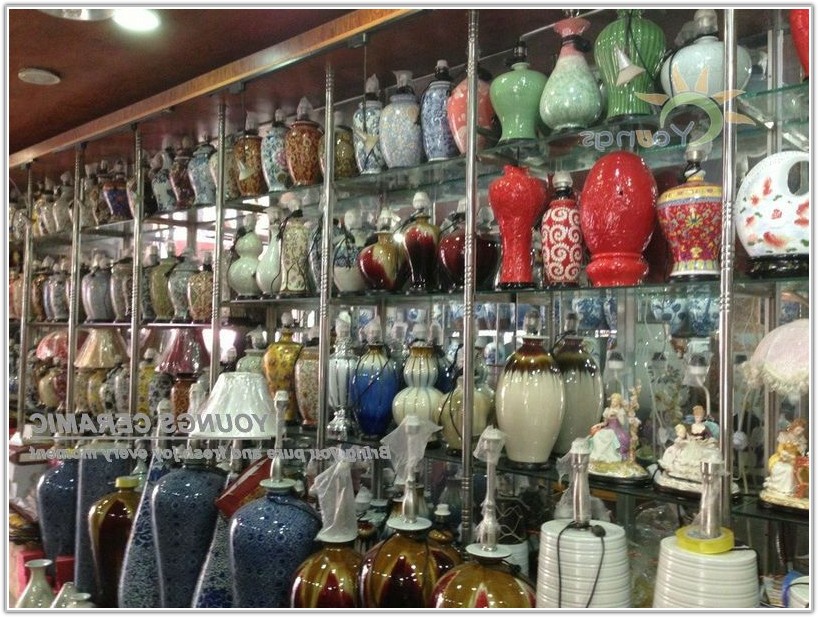
The image size is (818, 617). Find the location of `brown urns`. brown urns is located at coordinates (315, 579), (412, 582), (465, 595).